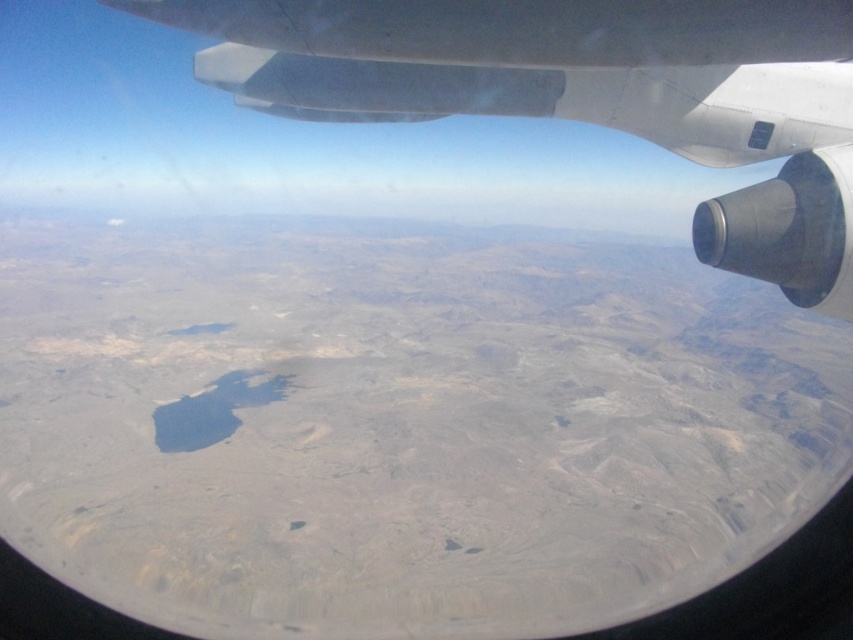
Question: Is metallic gray wing at upper center smaller than smooth white wing at upper center?

Choices:
 (A) no
 (B) yes

Answer: (A)

Question: Which object is farther from the camera taking this photo?

Choices:
 (A) metallic gray wing at upper center
 (B) smooth white wing at upper center

Answer: (A)

Question: Can you confirm if metallic gray wing at upper center is positioned to the right of smooth white wing at upper center?

Choices:
 (A) yes
 (B) no

Answer: (B)

Question: Does metallic gray wing at upper center appear over smooth white wing at upper center?

Choices:
 (A) yes
 (B) no

Answer: (A)